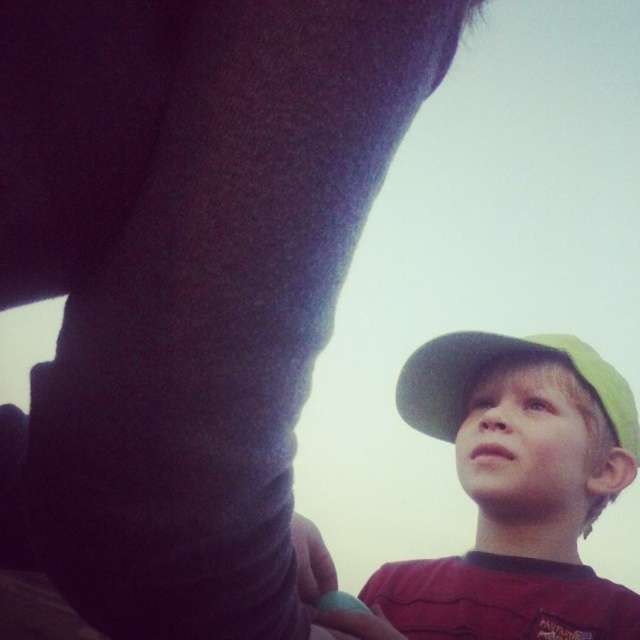
Question: Among these objects, which one is nearest to the camera?

Choices:
 (A) green fabric baseball hat at lower right
 (B) matte green cap at lower right

Answer: (B)

Question: Which object is closer to the camera taking this photo?

Choices:
 (A) green fabric baseball hat at lower right
 (B) matte green cap at lower right

Answer: (B)

Question: Does matte green cap at lower right appear on the right side of green fabric baseball hat at lower right?

Choices:
 (A) yes
 (B) no

Answer: (B)

Question: Does matte green cap at lower right appear under green fabric baseball hat at lower right?

Choices:
 (A) no
 (B) yes

Answer: (B)

Question: Does matte green cap at lower right appear on the right side of green fabric baseball hat at lower right?

Choices:
 (A) no
 (B) yes

Answer: (A)

Question: Which object appears closest to the camera in this image?

Choices:
 (A) matte green cap at lower right
 (B) green fabric baseball hat at lower right

Answer: (A)